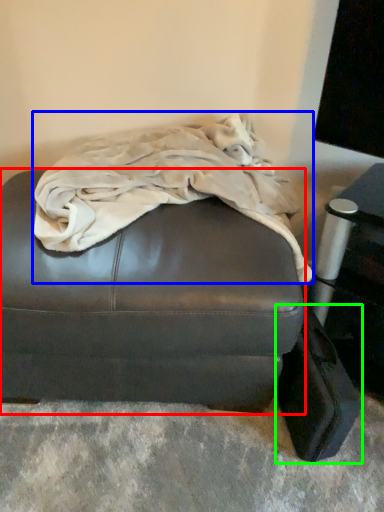
Question: Which object is the closest to the furniture (highlighted by a red box)? Choose among these: blanket (highlighted by a blue box) or luggage (highlighted by a green box).

Choices:
 (A) blanket
 (B) luggage

Answer: (A)